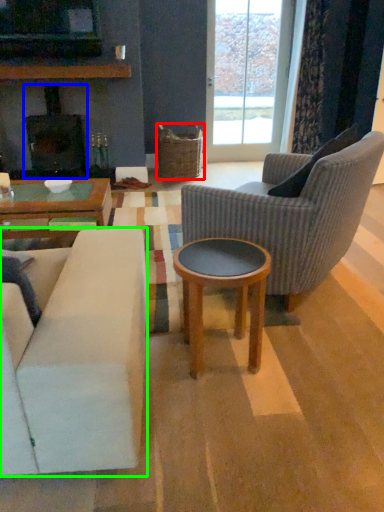
Question: Which object is the farthest from picnic basket (highlighted by a red box)? Choose among these: fireplace (highlighted by a blue box) or studio couch (highlighted by a green box).

Choices:
 (A) fireplace
 (B) studio couch

Answer: (B)